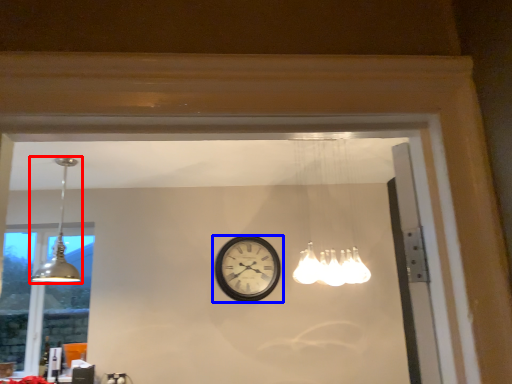
Question: Which point is closer to the camera, lamp (highlighted by a red box) or wall clock (highlighted by a blue box)?

Choices:
 (A) lamp
 (B) wall clock

Answer: (A)